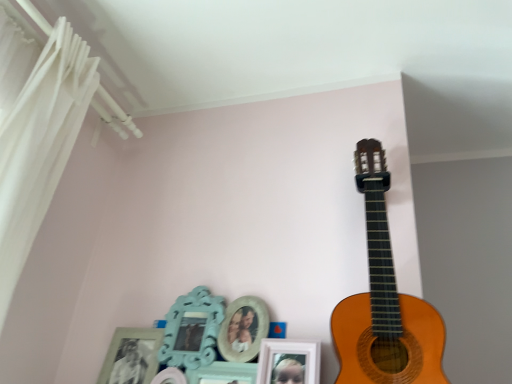
Where is `white sheer curtain at left`? white sheer curtain at left is located at coordinates (39, 145).

Describe the element at coordinates (39, 145) in the screenshot. I see `white sheer curtain at left` at that location.

From the picture: Measure the distance between point (402, 346) and camera.

Point (402, 346) is 1.02 meters away from camera.

This screenshot has width=512, height=384. What are the coordinates of `wooden acoustic guitar at upper right` in the screenshot? It's located at (384, 302).

Measure the distance between wooden acoustic guitar at upper right and camera.

wooden acoustic guitar at upper right and camera are 36.81 inches apart.

The width and height of the screenshot is (512, 384). What do you see at coordinates (384, 302) in the screenshot?
I see `wooden acoustic guitar at upper right` at bounding box center [384, 302].

Locate an element on the screen. white sheer curtain at left is located at coordinates (39, 145).

Considering the positions of objects wooden acoustic guitar at upper right and white sheer curtain at left in the image provided, who is more to the right, wooden acoustic guitar at upper right or white sheer curtain at left?

wooden acoustic guitar at upper right is more to the right.

From the picture: Which is in front, wooden acoustic guitar at upper right or white sheer curtain at left?

Positioned in front is white sheer curtain at left.

Does point (377, 309) come closer to viewer compared to point (26, 151)?

That is True.

From the image's perspective, is wooden acoustic guitar at upper right located beneath white sheer curtain at left?

Indeed, from the image's perspective, wooden acoustic guitar at upper right is shown beneath white sheer curtain at left.

From a real-world perspective, who is located higher, wooden acoustic guitar at upper right or white sheer curtain at left?

From a 3D spatial view, white sheer curtain at left is above.

In terms of width, does wooden acoustic guitar at upper right look wider or thinner when compared to white sheer curtain at left?

Clearly, wooden acoustic guitar at upper right has less width compared to white sheer curtain at left.

Who is taller, wooden acoustic guitar at upper right or white sheer curtain at left?

white sheer curtain at left.

Considering the sizes of objects wooden acoustic guitar at upper right and white sheer curtain at left in the image provided, who is bigger, wooden acoustic guitar at upper right or white sheer curtain at left?

white sheer curtain at left.

Is wooden acoustic guitar at upper right positioned beyond the bounds of white sheer curtain at left?

Yes, wooden acoustic guitar at upper right is outside of white sheer curtain at left.

Can you see wooden acoustic guitar at upper right touching white sheer curtain at left?

No.

Does wooden acoustic guitar at upper right turn towards white sheer curtain at left?

No.

How distant is wooden acoustic guitar at upper right from white sheer curtain at left?

wooden acoustic guitar at upper right and white sheer curtain at left are 36.39 inches apart from each other.

In the image, there is a wooden acoustic guitar at upper right. Where is `curtain above it (from the image's perspective)`? curtain above it (from the image's perspective) is located at coordinates (39, 145).

Looking at this image, considering the relative positions of white sheer curtain at left and wooden acoustic guitar at upper right in the image provided, is white sheer curtain at left to the left of wooden acoustic guitar at upper right from the viewer's perspective?

Correct, you'll find white sheer curtain at left to the left of wooden acoustic guitar at upper right.

Looking at this image, does white sheer curtain at left lie behind wooden acoustic guitar at upper right?

No, it is in front of wooden acoustic guitar at upper right.

Which point is more distant from viewer, [11,255] or [364,309]?

The point [11,255] is behind.

From the image's perspective, between white sheer curtain at left and wooden acoustic guitar at upper right, which one is located above?

white sheer curtain at left, from the image's perspective.

From a real-world perspective, is white sheer curtain at left on top of wooden acoustic guitar at upper right?

Yes, from a real-world perspective, white sheer curtain at left is over wooden acoustic guitar at upper right

Which object is wider, white sheer curtain at left or wooden acoustic guitar at upper right?

white sheer curtain at left is wider.

Which of these two, white sheer curtain at left or wooden acoustic guitar at upper right, stands taller?

white sheer curtain at left.

Which of these two, white sheer curtain at left or wooden acoustic guitar at upper right, is bigger?

Bigger between the two is white sheer curtain at left.

Which is correct: white sheer curtain at left is inside wooden acoustic guitar at upper right, or outside of it?

The correct answer is: outside.

Is white sheer curtain at left not close to wooden acoustic guitar at upper right?

No, white sheer curtain at left is not far away from wooden acoustic guitar at upper right.

Could you tell me if white sheer curtain at left is turned towards wooden acoustic guitar at upper right?

No, white sheer curtain at left does not turn towards wooden acoustic guitar at upper right.

How different are the orientations of white sheer curtain at left and wooden acoustic guitar at upper right in degrees?

86.1 degrees separate the facing orientations of white sheer curtain at left and wooden acoustic guitar at upper right.

Locate an element on the screen. The width and height of the screenshot is (512, 384). guitar on the right of white sheer curtain at left is located at coordinates (384, 302).

In the image, there is a white sheer curtain at left. Identify the location of guitar below it (from the image's perspective). (384, 302).

Find the location of a particular element. curtain above the wooden acoustic guitar at upper right (from the image's perspective) is located at coordinates (39, 145).